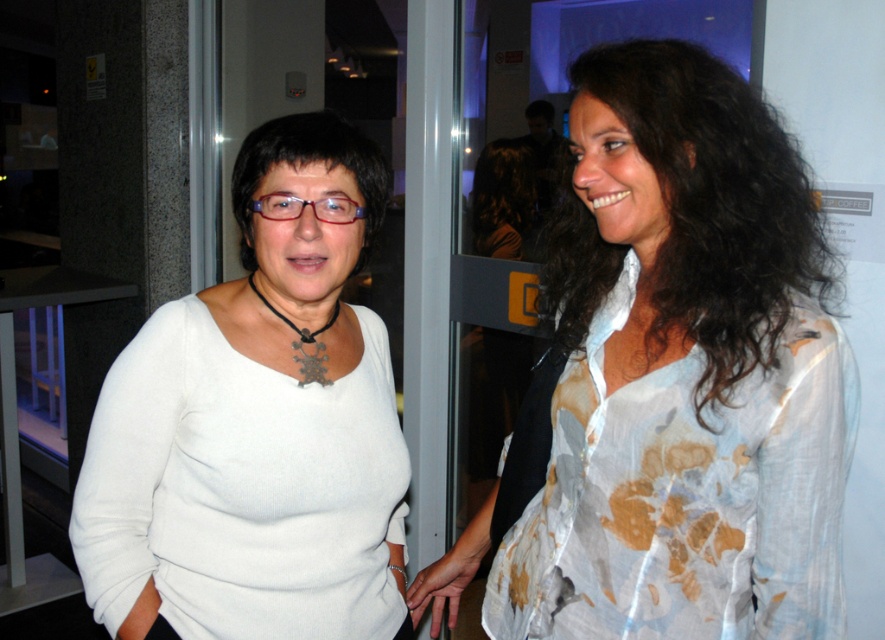
Question: Does white matte sweater at center have a smaller size compared to black curly hair at upper right?

Choices:
 (A) no
 (B) yes

Answer: (A)

Question: Which point is closer to the camera taking this photo?

Choices:
 (A) (627, 564)
 (B) (204, 548)

Answer: (A)

Question: Is white sheer blouse at right bigger than black curly hair at upper right?

Choices:
 (A) yes
 (B) no

Answer: (A)

Question: Among these objects, which one is farthest from the camera?

Choices:
 (A) white sheer blouse at right
 (B) white matte sweater at center

Answer: (B)

Question: Which point is farther to the camera?

Choices:
 (A) (716, 378)
 (B) (187, 605)

Answer: (B)

Question: Is white sheer blouse at right to the left of black curly hair at upper right from the viewer's perspective?

Choices:
 (A) no
 (B) yes

Answer: (A)